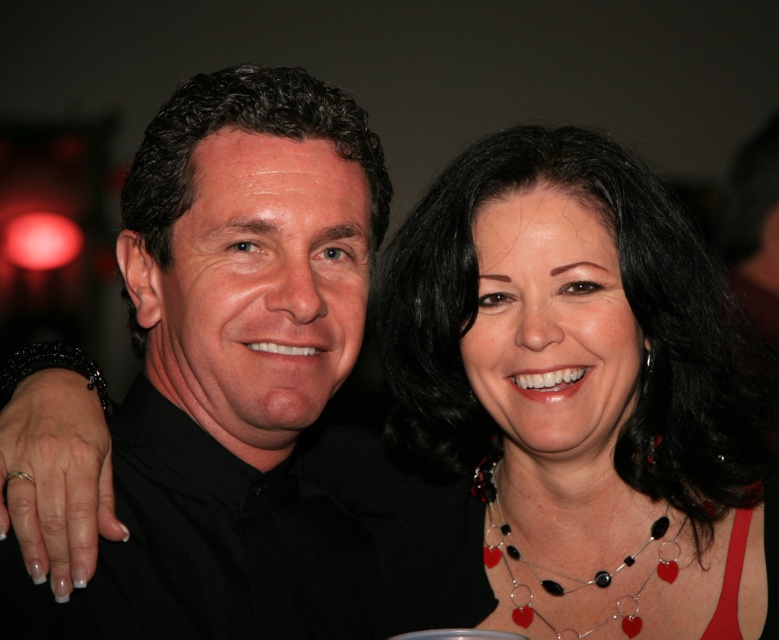
You are a photographer trying to adjust the lighting for a photo shoot. You have a spotlight that can only illuminate an area within a circle of radius 0.3 centered at point 0.5,0.5. Will the black matte shirt at center be illuminated by this spotlight?

The black matte shirt at center is located at point (231, 369). The spotlight is centered at (389, 320) with radius 0.3. Calculating the distance between the two points using the distance formula sqrt 0.078 squared plus 0.201 squared equals approximately sqrt 0.006084 plus 0.040401 equals sqrt 0.046485 equals approximately 0.2156. Since 0.2156 is less than 0.3, the black matte shirt at center is within the spotlight area and will be illuminated.

You are a photographer trying to focus on the black matte shirt at center in a photo. The camera has a focus point at coordinates point (231, 369). Is the focus point correctly positioned to capture the black matte shirt at center?

The point (231, 369) indicates the black matte shirt at center, so yes, the focus point is correctly positioned to capture the black matte shirt at center.